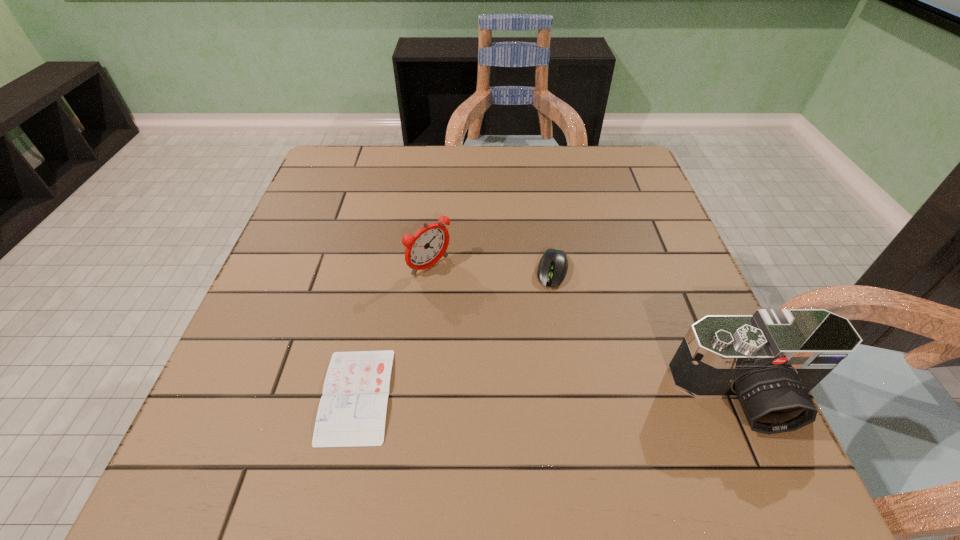
Locate an element on the screen. Image resolution: width=960 pixels, height=540 pixels. vacant space in between the rightmost object and the alarm clock is located at coordinates (588, 331).

This screenshot has width=960, height=540. Find the location of `free point between the computer mouse and the diary`. free point between the computer mouse and the diary is located at coordinates (454, 333).

Locate an element on the screen. The width and height of the screenshot is (960, 540). vacant area that lies between the third shortest object and the camera is located at coordinates (588, 331).

Identify which object is the third closest to the shortest object. Please provide its 2D coordinates. Your answer should be formatted as a tuple, i.e. [(x, y)], where the tuple contains the x and y coordinates of a point satisfying the conditions above.

[(771, 360)]

Where is `object that stands as the closest to the rightmost object`? The width and height of the screenshot is (960, 540). object that stands as the closest to the rightmost object is located at coordinates (553, 266).